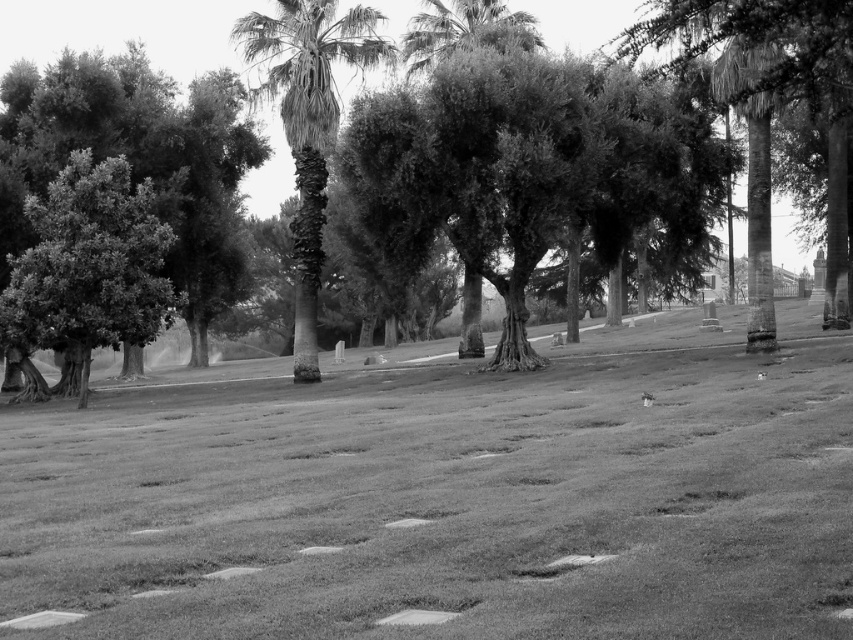
Question: Based on their relative distances, which object is nearer to the smooth bark palm tree at center?

Choices:
 (A) grassy lawn at center
 (B) green leafy tree at center

Answer: (A)

Question: Is green leafy tree at center to the left of smooth bark palm tree at center from the viewer's perspective?

Choices:
 (A) no
 (B) yes

Answer: (B)

Question: Is green leafy tree at center to the right of smooth bark palm tree at center from the viewer's perspective?

Choices:
 (A) no
 (B) yes

Answer: (A)

Question: Which point is closer to the camera?

Choices:
 (A) smooth bark palm tree at center
 (B) grassy lawn at center

Answer: (B)

Question: Which object is closer to the camera taking this photo?

Choices:
 (A) green leafy tree at center
 (B) smooth bark palm tree at center
 (C) grassy lawn at center

Answer: (C)

Question: Is grassy lawn at center to the left of smooth bark palm tree at center from the viewer's perspective?

Choices:
 (A) no
 (B) yes

Answer: (A)